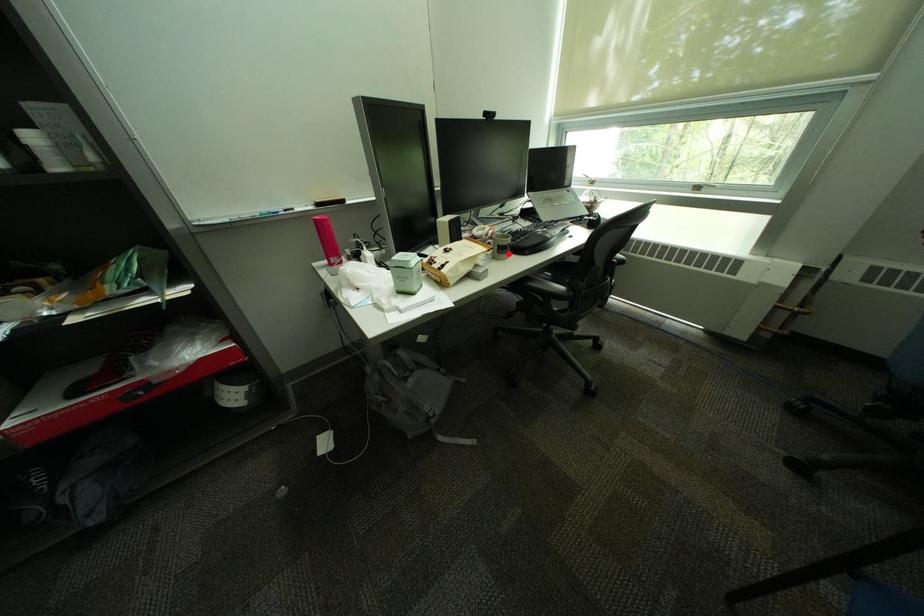
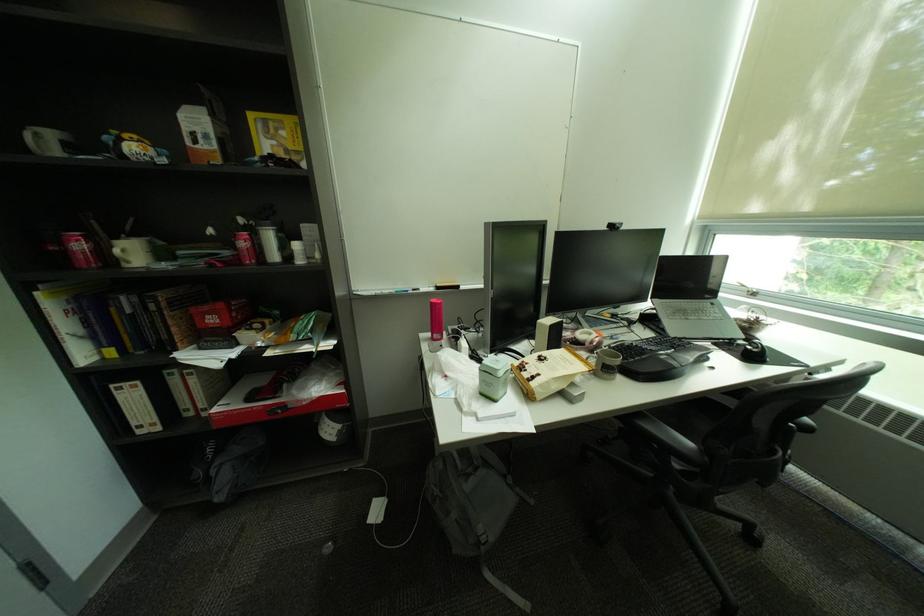
Find the pixel in the second image that matches the highlighted location in the first image.

(613, 371)